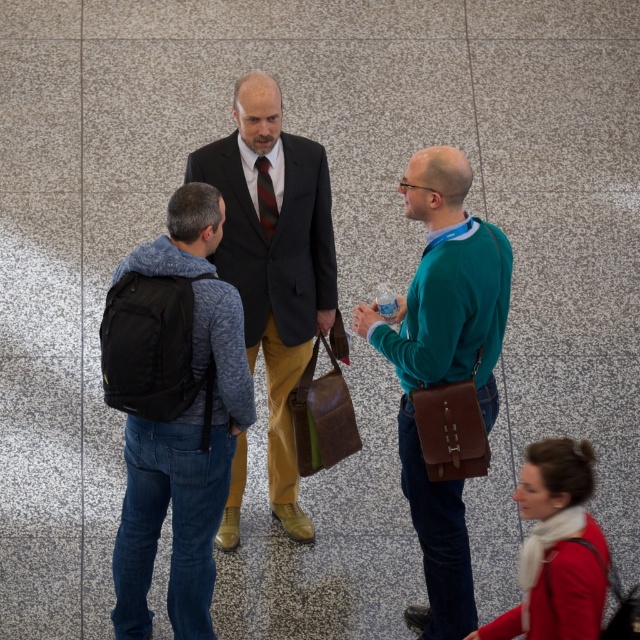
Which is more to the right, teal leather briefcase at center or matte black suit at center?

teal leather briefcase at center

Locate an element on the screen. The height and width of the screenshot is (640, 640). teal leather briefcase at center is located at coordinates (444, 376).

Is point (506, 256) positioned in front of point (253, 337)?

Yes.

Identify the location of teal leather briefcase at center. (444, 376).

Based on the photo, is teal leather briefcase at center to the right of striped silk tie at center from the viewer's perspective?

Yes, teal leather briefcase at center is to the right of striped silk tie at center.

Can you confirm if teal leather briefcase at center is positioned to the left of striped silk tie at center?

No, teal leather briefcase at center is not to the left of striped silk tie at center.

Locate an element on the screen. teal leather briefcase at center is located at coordinates (444, 376).

Which is below, matte black suit at center or striped silk tie at center?

Positioned lower is matte black suit at center.

The height and width of the screenshot is (640, 640). Identify the location of matte black suit at center. (275, 262).